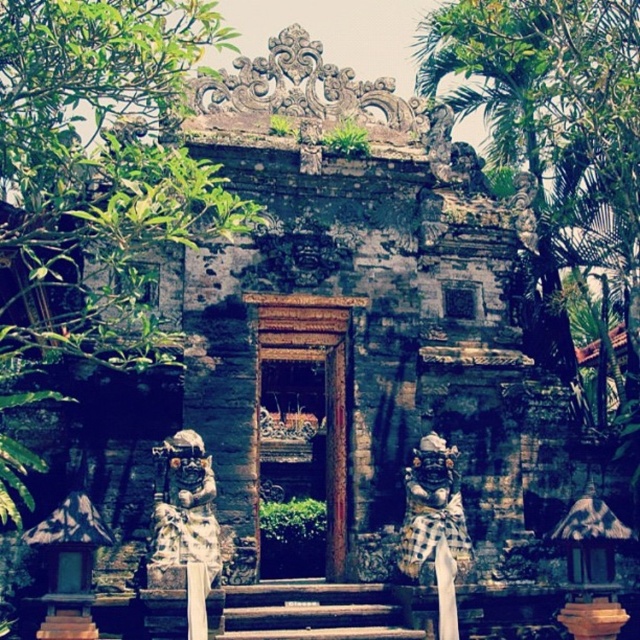
You are a visitor approaching the temple entrance. You notice the wooden door at center and the carved stone statue at center. Which object is positioned to the left when viewed from the front of the temple?

The wooden door at center is to the left of the carved stone statue at center, so the wooden door at center is positioned to the left when viewed from the front of the temple.

You are a visitor at the temple and want to take a photo of both the wooden door at center and the carved stone statue at center. Since you have a camera with a fixed focal length, you need to stand at a position where both objects are fully visible in the frame. Considering their sizes, which object should you focus on to ensure both are in the frame?

The wooden door at center is larger than the carved stone statue at center. To ensure both are fully visible in the frame, you should focus on the wooden door at center since it requires more space in the frame due to its larger size.